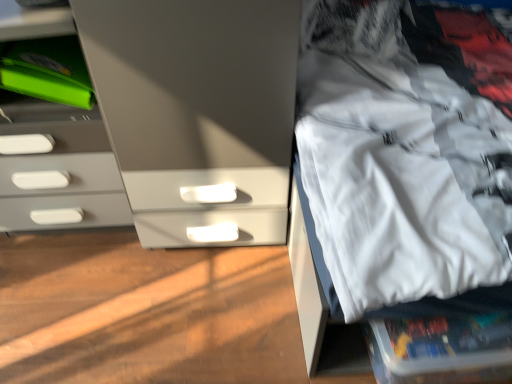
The image size is (512, 384). What do you see at coordinates (56, 167) in the screenshot?
I see `matte gray chest of drawers at left` at bounding box center [56, 167].

What are the coordinates of `matte gray chest of drawers at left` in the screenshot? It's located at (56, 167).

You are a GUI agent. You are given a task and a screenshot of the screen. Output one action in this format:
    pyautogui.click(x=<x>, y=<y>)
    Task: Click on the white fabric at right
    
    Given the screenshot: What is the action you would take?
    pyautogui.click(x=407, y=146)

Image resolution: width=512 pixels, height=384 pixels. Describe the element at coordinates (407, 146) in the screenshot. I see `white fabric at right` at that location.

Where is `matte gray chest of drawers at left`? The image size is (512, 384). matte gray chest of drawers at left is located at coordinates (56, 167).

Can you confirm if white fabric at right is positioned to the right of matte gray chest of drawers at left?

Correct, you'll find white fabric at right to the right of matte gray chest of drawers at left.

Between white fabric at right and matte gray chest of drawers at left, which one is positioned behind?

matte gray chest of drawers at left.

Between point (447, 244) and point (79, 226), which one is positioned in front?

Positioned in front is point (447, 244).

From the image's perspective, which is above, white fabric at right or matte gray chest of drawers at left?

matte gray chest of drawers at left, from the image's perspective.

From a real-world perspective, does white fabric at right stand above matte gray chest of drawers at left?

Yes, from a real-world perspective, white fabric at right is over matte gray chest of drawers at left

Can you confirm if white fabric at right is wider than matte gray chest of drawers at left?

Yes, white fabric at right is wider than matte gray chest of drawers at left.

Which of these two, white fabric at right or matte gray chest of drawers at left, stands taller?

Standing taller between the two is white fabric at right.

Does white fabric at right have a larger size compared to matte gray chest of drawers at left?

Yes, white fabric at right is bigger than matte gray chest of drawers at left.

Based on the photo, choose the correct answer: Is white fabric at right inside matte gray chest of drawers at left or outside it?

white fabric at right is not inside matte gray chest of drawers at left, it's outside.

Is white fabric at right not close to matte gray chest of drawers at left?

That's not correct — white fabric at right is a little close to matte gray chest of drawers at left.

Is matte gray chest of drawers at left at the back of white fabric at right?

No, matte gray chest of drawers at left is not at the back of white fabric at right.

Can you tell me how much white fabric at right and matte gray chest of drawers at left differ in facing direction?

The angle between the facing direction of white fabric at right and the facing direction of matte gray chest of drawers at left is 90.8 degrees.

How far apart are white fabric at right and matte gray chest of drawers at left?

The distance of white fabric at right from matte gray chest of drawers at left is 29.30 inches.

Where is `clothing located below the matte gray chest of drawers at left (from the image's perspective)`? Image resolution: width=512 pixels, height=384 pixels. clothing located below the matte gray chest of drawers at left (from the image's perspective) is located at coordinates (407, 146).

Is matte gray chest of drawers at left at the left side of white fabric at right?

Yes.

Is matte gray chest of drawers at left in front of or behind white fabric at right in the image?

In the image, matte gray chest of drawers at left appears behind white fabric at right.

Which is behind, point (13, 136) or point (335, 6)?

The point (335, 6) is more distant.

Looking at this image, from the image's perspective, is matte gray chest of drawers at left on top of white fabric at right?

Yes, from the image's perspective, matte gray chest of drawers at left is above white fabric at right.

From a real-world perspective, is matte gray chest of drawers at left located beneath white fabric at right?

Yes.

Is matte gray chest of drawers at left thinner than white fabric at right?

Yes, matte gray chest of drawers at left is thinner than white fabric at right.

Considering the relative sizes of matte gray chest of drawers at left and white fabric at right in the image provided, is matte gray chest of drawers at left taller than white fabric at right?

In fact, matte gray chest of drawers at left may be shorter than white fabric at right.

Does matte gray chest of drawers at left have a smaller size compared to white fabric at right?

Yes, matte gray chest of drawers at left is smaller than white fabric at right.

Is matte gray chest of drawers at left located outside white fabric at right?

That's correct, matte gray chest of drawers at left is outside of white fabric at right.

Is matte gray chest of drawers at left beside white fabric at right?

No, matte gray chest of drawers at left is not in contact with white fabric at right.

Based on the photo, is matte gray chest of drawers at left aimed at white fabric at right?

No, matte gray chest of drawers at left is not aimed at white fabric at right.

Looking at this image, can you tell me how much matte gray chest of drawers at left and white fabric at right differ in facing direction?

The angular difference between matte gray chest of drawers at left and white fabric at right is 90.8 degrees.

Image resolution: width=512 pixels, height=384 pixels. There is a matte gray chest of drawers at left. What are the coordinates of `clothing above it (from a real-world perspective)` in the screenshot? It's located at (407, 146).

Image resolution: width=512 pixels, height=384 pixels. Find the location of `clothing above the matte gray chest of drawers at left (from a real-world perspective)`. clothing above the matte gray chest of drawers at left (from a real-world perspective) is located at coordinates (x=407, y=146).

I want to click on chest of drawers on the left of white fabric at right, so click(56, 167).